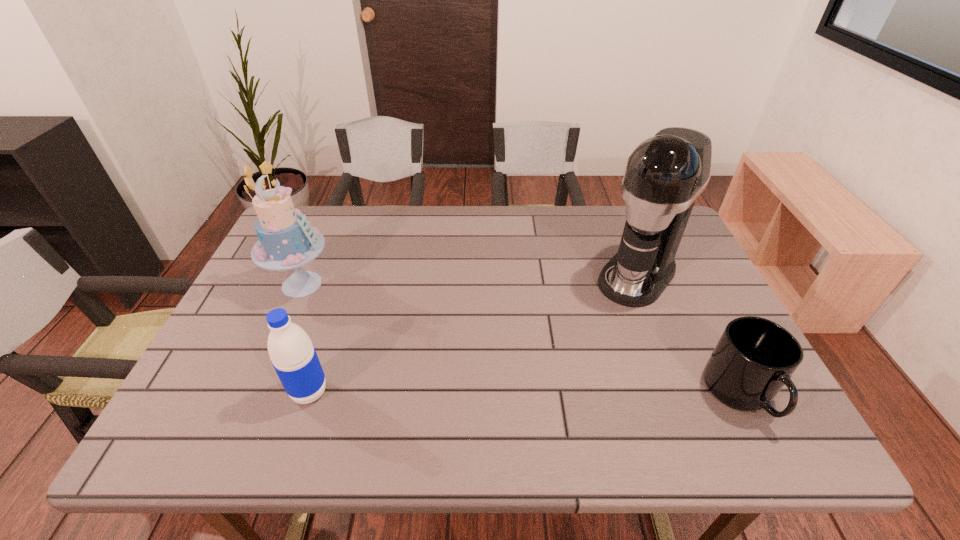
This screenshot has height=540, width=960. In the image, there is a desktop. Find the location of `vacant space at the near edge`. vacant space at the near edge is located at coordinates (511, 387).

This screenshot has height=540, width=960. In order to click on vacant space at the far left corner of the desktop in this screenshot , I will do `click(306, 218)`.

Find the location of a particular element. The image size is (960, 540). free region at the near left corner of the desktop is located at coordinates (217, 403).

At what (x,y) coordinates should I click in order to perform the action: click on empty location between the second tallest object and the coffee maker. Please return your answer as a coordinate pair (x, y). The height and width of the screenshot is (540, 960). Looking at the image, I should click on (469, 280).

Identify the location of vacant region between the third shortest object and the coffee maker. (469, 280).

This screenshot has height=540, width=960. I want to click on unoccupied position between the shortest object and the third tallest object, so click(x=525, y=393).

This screenshot has width=960, height=540. Identify the location of free space between the mug and the third shortest object. (521, 339).

You are a GUI agent. You are given a task and a screenshot of the screen. Output one action in this format:
    pyautogui.click(x=<x>, y=<y>)
    Task: Click on the free area in between the coffee maker and the third shortest object
    The width and height of the screenshot is (960, 540).
    Given the screenshot: What is the action you would take?
    pyautogui.click(x=469, y=280)

I want to click on free space between the mug and the second tallest object, so pyautogui.click(x=521, y=339).

At what (x,y) coordinates should I click in order to perform the action: click on vacant space in between the mug and the cake. Please return your answer as a coordinate pair (x, y). Looking at the image, I should click on (521, 339).